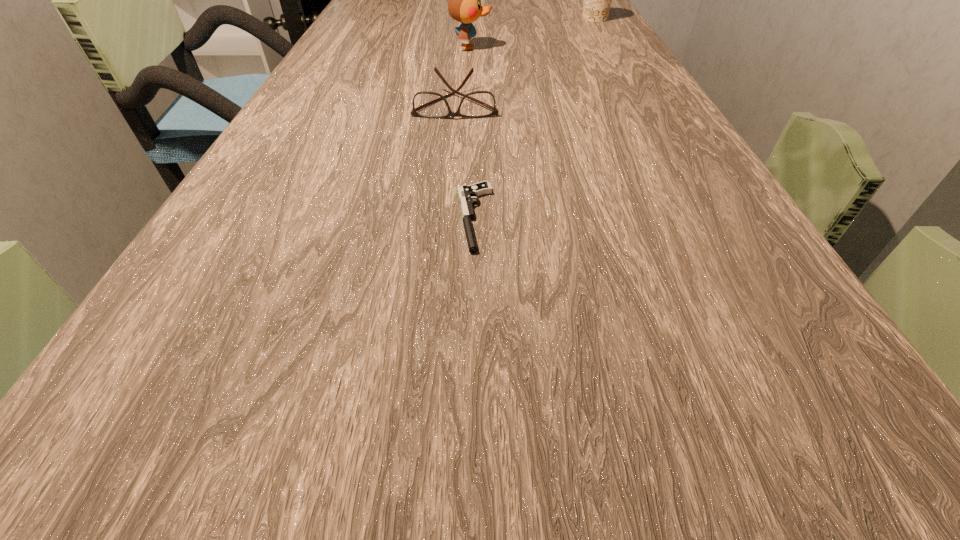
At what (x,y) coordinates should I click in order to perform the action: click on free space that is in between the third shortest object and the third nearest object. Please return your answer as a coordinate pair (x, y). This screenshot has width=960, height=540. Looking at the image, I should click on (x=533, y=33).

The height and width of the screenshot is (540, 960). What are the coordinates of `vacant point located between the nearest object and the Dixie cup` in the screenshot? It's located at (535, 118).

The height and width of the screenshot is (540, 960). Identify the location of free space between the spectacles and the Dixie cup. pos(525,61).

Where is `vacant region between the second nearest object and the Dixie cup`? Image resolution: width=960 pixels, height=540 pixels. vacant region between the second nearest object and the Dixie cup is located at coordinates (525, 61).

In order to click on free space between the tallest object and the nearest object in this screenshot , I will do `click(472, 132)`.

This screenshot has width=960, height=540. What are the coordinates of `free point between the third shortest object and the second nearest object` in the screenshot? It's located at (525, 61).

Where is `free space between the pistol and the second farthest object`? free space between the pistol and the second farthest object is located at coordinates (472, 132).

Select which object is the third closest to the third nearest object. Please provide its 2D coordinates. Your answer should be formatted as a tuple, i.e. [(x, y)], where the tuple contains the x and y coordinates of a point satisfying the conditions above.

[(466, 193)]

Point out which object is positioned as the second nearest to the third farthest object. Please provide its 2D coordinates. Your answer should be formatted as a tuple, i.e. [(x, y)], where the tuple contains the x and y coordinates of a point satisfying the conditions above.

[(466, 193)]

Locate an element on the screen. This screenshot has width=960, height=540. free space that satisfies the following two spatial constraints: 1. on the front-facing side of the tallest object; 2. on the front-facing side of the second nearest object is located at coordinates (468, 103).